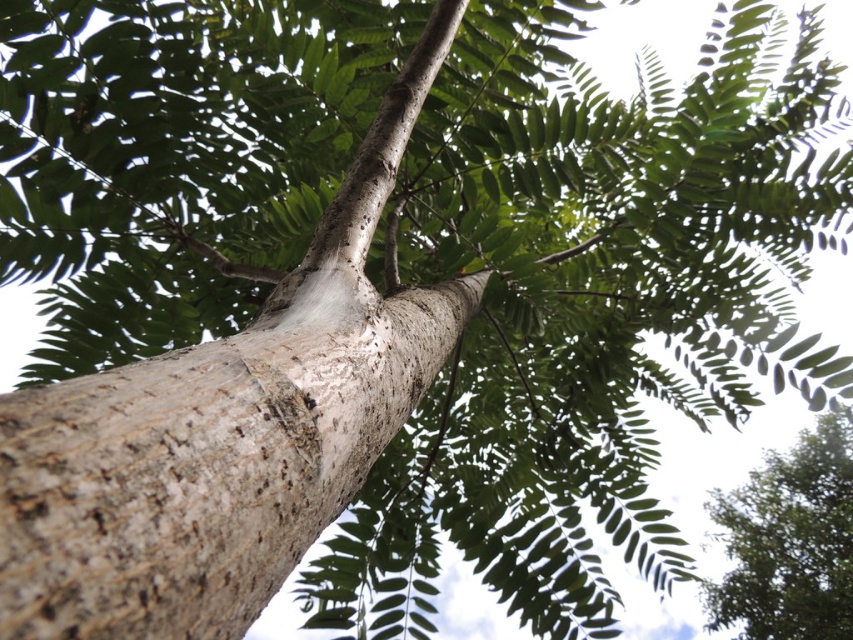
Question: Which point appears farthest from the camera in this image?

Choices:
 (A) pyautogui.click(x=305, y=300)
 (B) pyautogui.click(x=810, y=557)

Answer: (B)

Question: Which object appears farthest from the camera in this image?

Choices:
 (A) green rough bark tree at upper right
 (B) smooth bark tree trunk at center

Answer: (A)

Question: Can you confirm if smooth bark tree trunk at center is thinner than green rough bark tree at upper right?

Choices:
 (A) yes
 (B) no

Answer: (A)

Question: Does smooth bark tree trunk at center appear on the left side of green rough bark tree at upper right?

Choices:
 (A) no
 (B) yes

Answer: (B)

Question: Can you confirm if smooth bark tree trunk at center is positioned to the right of green rough bark tree at upper right?

Choices:
 (A) no
 (B) yes

Answer: (A)